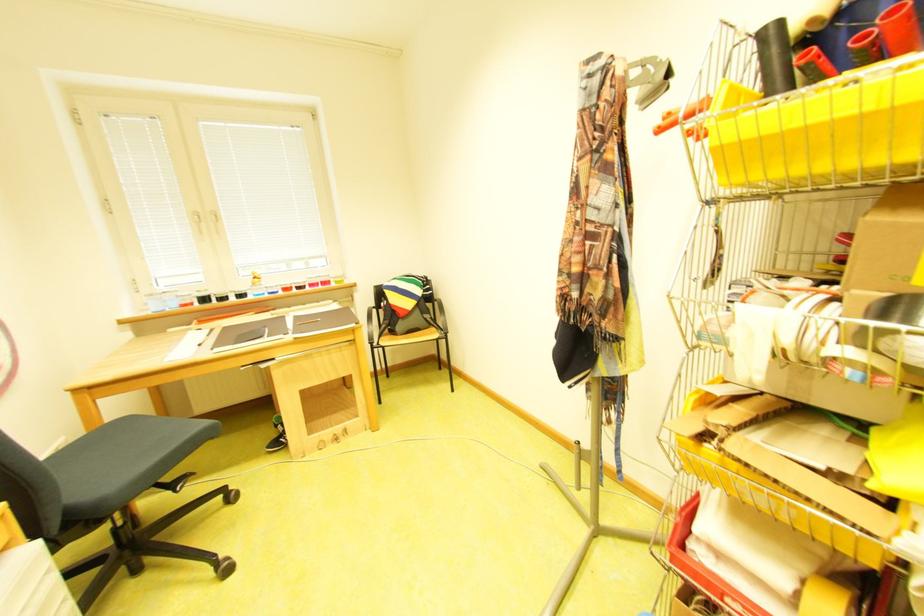
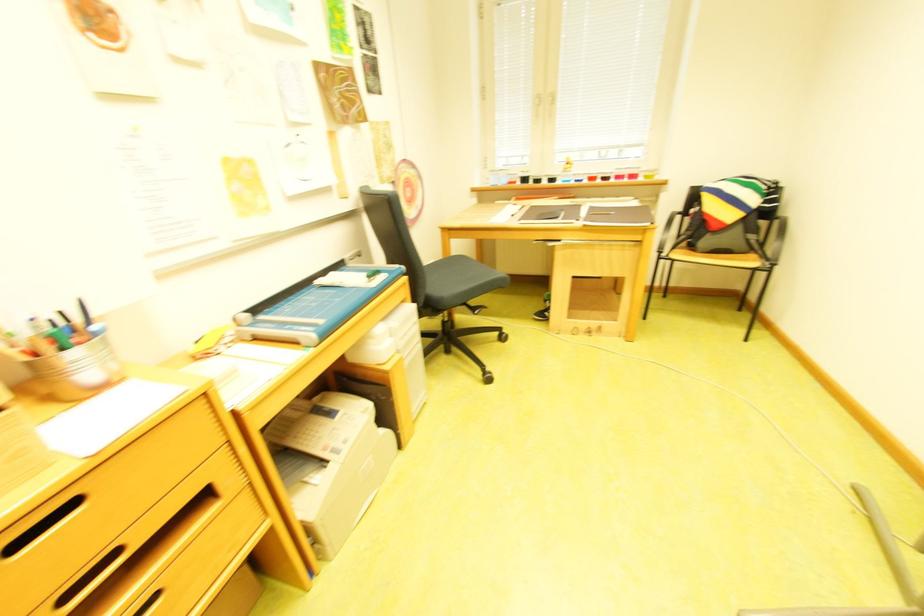
Based on the photo, the first image is from the beginning of the video and the second image is from the end. How did the camera likely rotate when shooting the video?

The rotation direction of the camera is left-down.